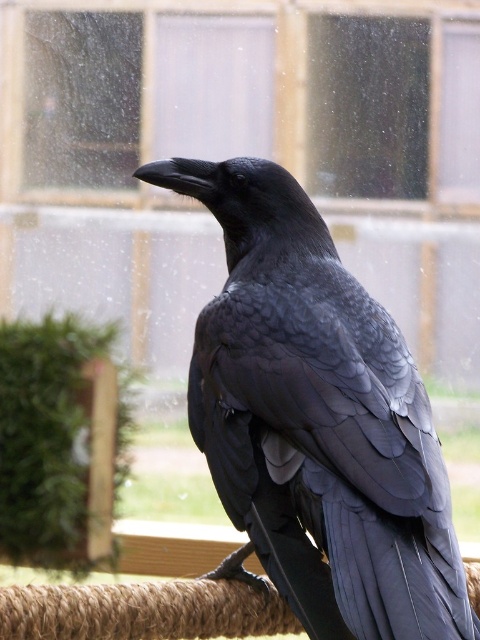
From the picture: Is the position of transparent glass window at upper center less distant than that of black feathered raven at center?

No, transparent glass window at upper center is further to the viewer.

Between point (108, 83) and point (288, 419), which one is positioned in front?

Point (288, 419)

Find the location of a particular element. This screenshot has width=480, height=640. transparent glass window at upper center is located at coordinates (240, 154).